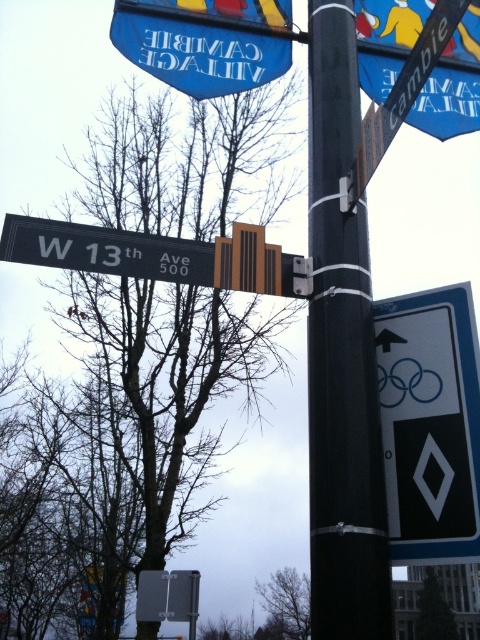
You are a pedestrian standing on the sidewalk. You see the black plastic pole at center and the bare branches at lower center. Which object is closer to the ground?

The bare branches at lower center are closer to the ground because the black plastic pole at center is above them.